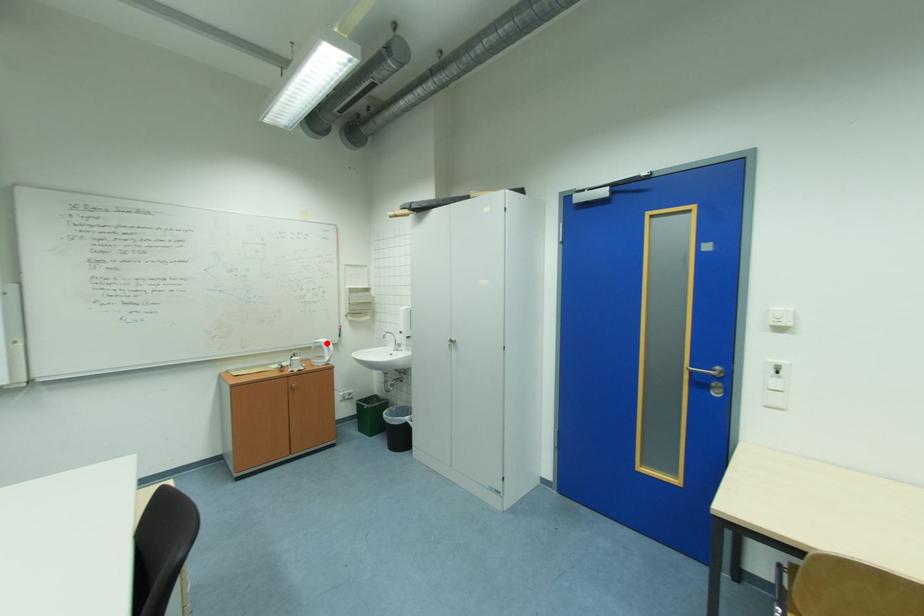
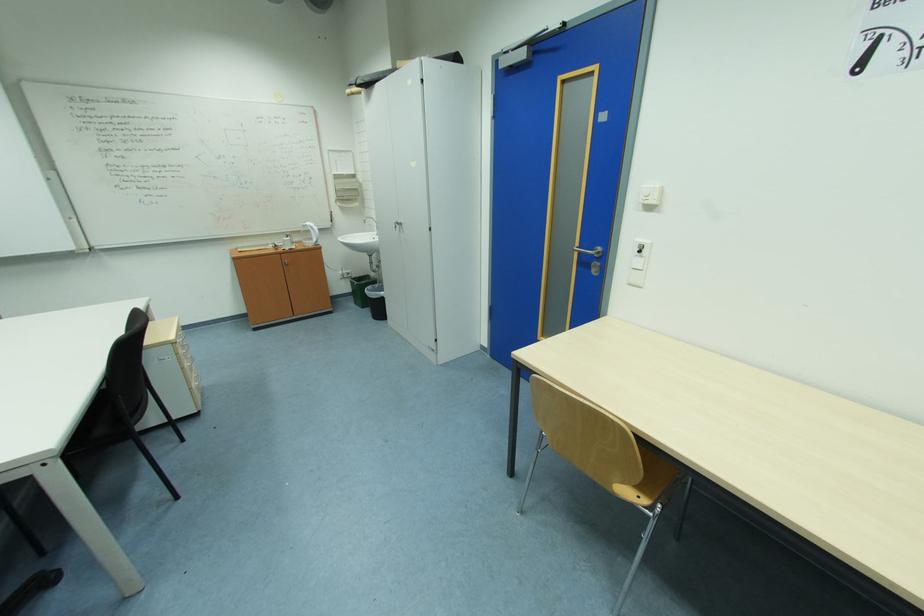
Question: I am providing you with two images of the same scene from different viewpoints. A red point is shown in image1. For the corresponding object point in image2, is it positioned nearer or farther from the camera?

Choices:
 (A) Nearer
 (B) Farther

Answer: (A)